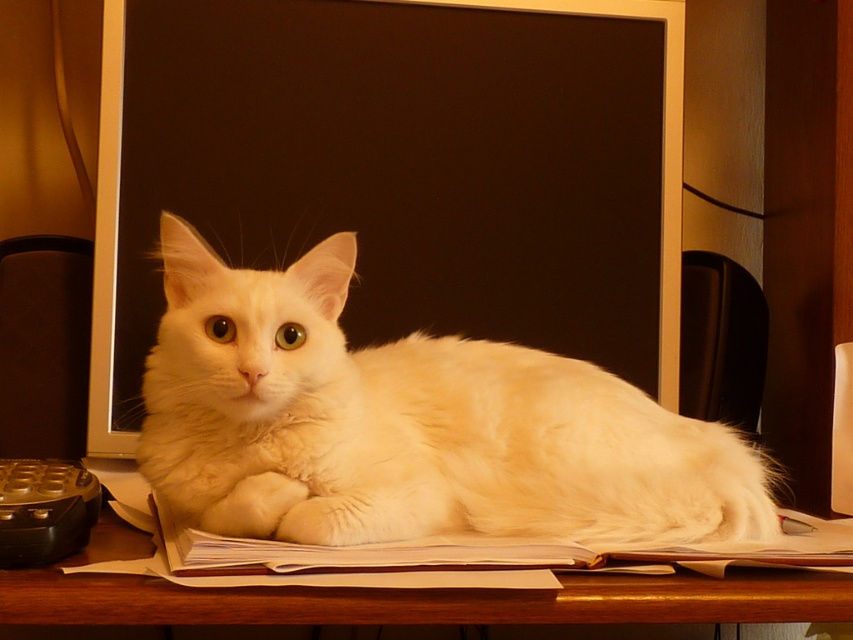
You are a photographer trying to capture a closeup of the cat. You notice two points in the image labeled as point [543,291] and point [593,600]. Which point should you focus on to ensure the cat is in sharp focus?

You should focus on point [543,291] because it is closer to the camera than point [593,600], ensuring the cat is in focus.

You are a person sitting at the desk and want to reach for the black matte computer screen at center and the wooden table at lower center. Which object is closer to you?

The black matte computer screen at center is closer to you because it is positioned further to the viewer than the wooden table at lower center, which is farther away.

You are a delivery robot that needs to place a small package on the desk. The package is 12 inches wide. There are two items on the desk that might block the space where you want to place it. Can you fit the package between the black matte computer screen at center and the white fluffy cat at center?

The black matte computer screen at center and white fluffy cat at center are 12.72 inches apart. Since the package is 12 inches wide, it can fit between them as there is enough space.